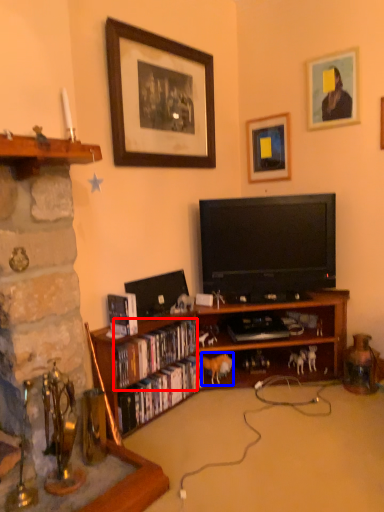
Question: Among these objects, which one is farthest to the camera, book (highlighted by a red box) or animal (highlighted by a blue box)?

Choices:
 (A) book
 (B) animal

Answer: (B)